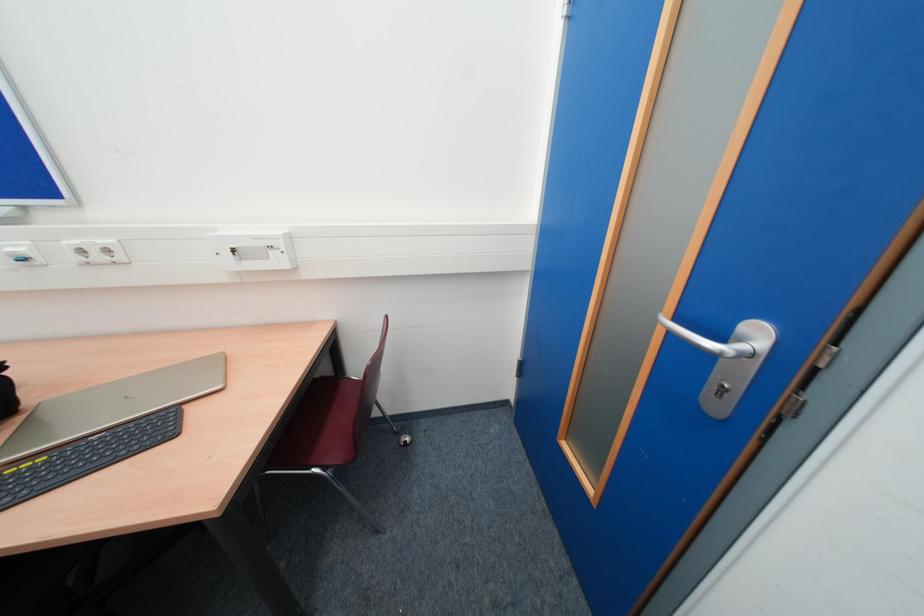
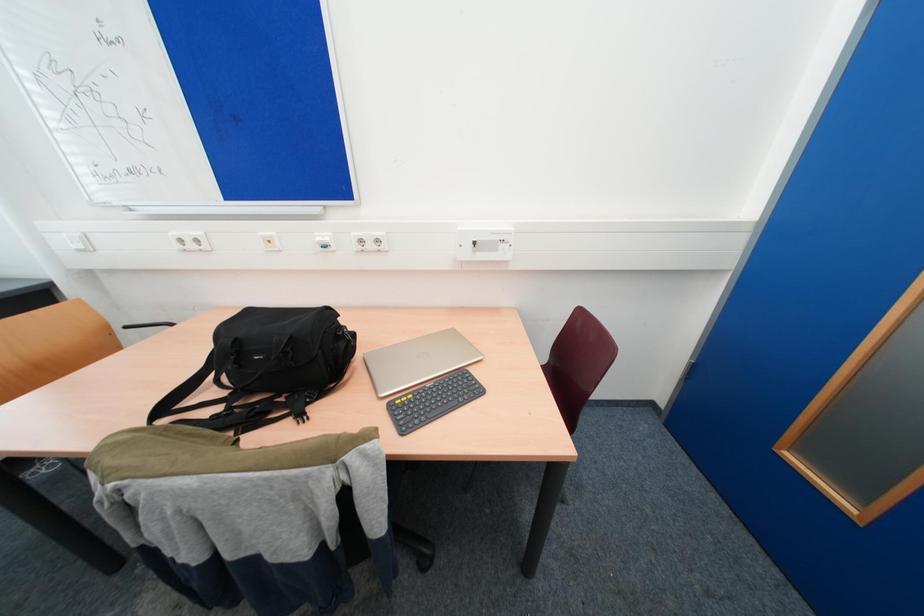
Question: The images are taken continuously from a first-person perspective. In which direction is your viewpoint rotating?

Choices:
 (A) Left
 (B) Right
 (C) Up
 (D) Down

Answer: (A)